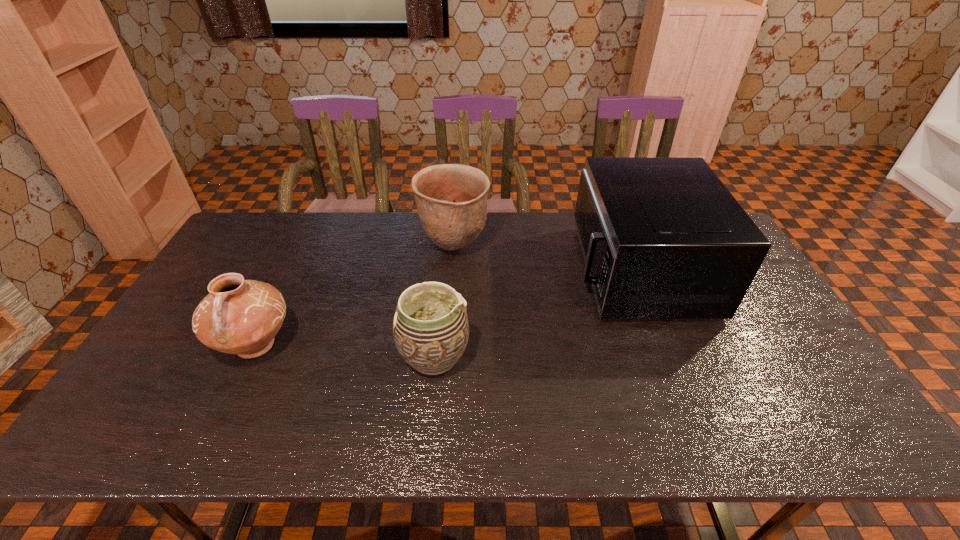
Locate an element on the screen. This screenshot has width=960, height=540. object at the left edge is located at coordinates (238, 316).

Locate an element on the screen. The height and width of the screenshot is (540, 960). object present at the right edge is located at coordinates (662, 237).

You are a GUI agent. You are given a task and a screenshot of the screen. Output one action in this format:
    pyautogui.click(x=<x>, y=<y>)
    Task: Click on the object that is at the far right corner
    This screenshot has width=960, height=540.
    Given the screenshot: What is the action you would take?
    pyautogui.click(x=662, y=237)

Find the location of a particular element. This screenshot has height=540, width=960. vacant space at the far edge is located at coordinates (492, 217).

This screenshot has width=960, height=540. In the image, there is a desktop. What are the coordinates of `vacant space at the near edge` in the screenshot? It's located at (x=245, y=424).

Where is `vacant space at the left edge of the desktop`? This screenshot has width=960, height=540. vacant space at the left edge of the desktop is located at coordinates (204, 284).

Find the location of a particular element. vacant space at the far left corner of the desktop is located at coordinates (246, 250).

In the image, there is a desktop. Identify the location of free space at the near left corner. (150, 436).

You are a GUI agent. You are given a task and a screenshot of the screen. Output one action in this format:
    pyautogui.click(x=<x>, y=<y>)
    Task: Click on the vacant space at the near right corner of the desktop
    This screenshot has width=960, height=540.
    Given the screenshot: What is the action you would take?
    pyautogui.click(x=812, y=420)

Locate an element on the screen. unoccupied area between the farthest pottery and the microwave_oven is located at coordinates (545, 259).